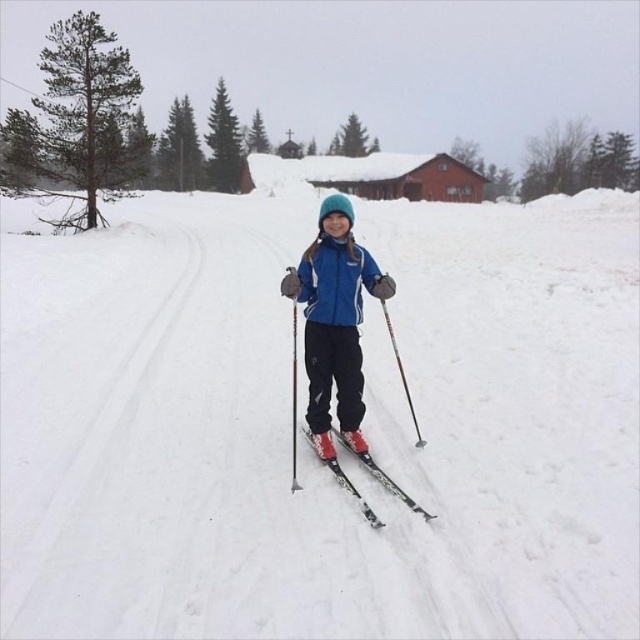
The width and height of the screenshot is (640, 640). What do you see at coordinates (301, 435) in the screenshot? I see `white matte snow at center` at bounding box center [301, 435].

Identify the location of white matte snow at center. (301, 435).

Does shiny black skis at center appear on the right side of metallic silver ski pole at center?

Correct, you'll find shiny black skis at center to the right of metallic silver ski pole at center.

Who is higher up, shiny black skis at center or metallic silver ski pole at center?

shiny black skis at center is above.

You are a GUI agent. You are given a task and a screenshot of the screen. Output one action in this format:
    pyautogui.click(x=<x>, y=<y>)
    Task: Click on the shiny black skis at center
    This screenshot has width=640, height=640.
    Given the screenshot: What is the action you would take?
    [381, 476]

Which is in front, point (435, 240) or point (384, 276)?

Point (384, 276) is more forward.

Is white matte snow at center shorter than blue matte jacket at center?

Incorrect, white matte snow at center's height does not fall short of blue matte jacket at center's.

Which is behind, point (193, 417) or point (321, 404)?

The point (193, 417) is behind.

Identify the location of white matte snow at center. The image size is (640, 640). (301, 435).